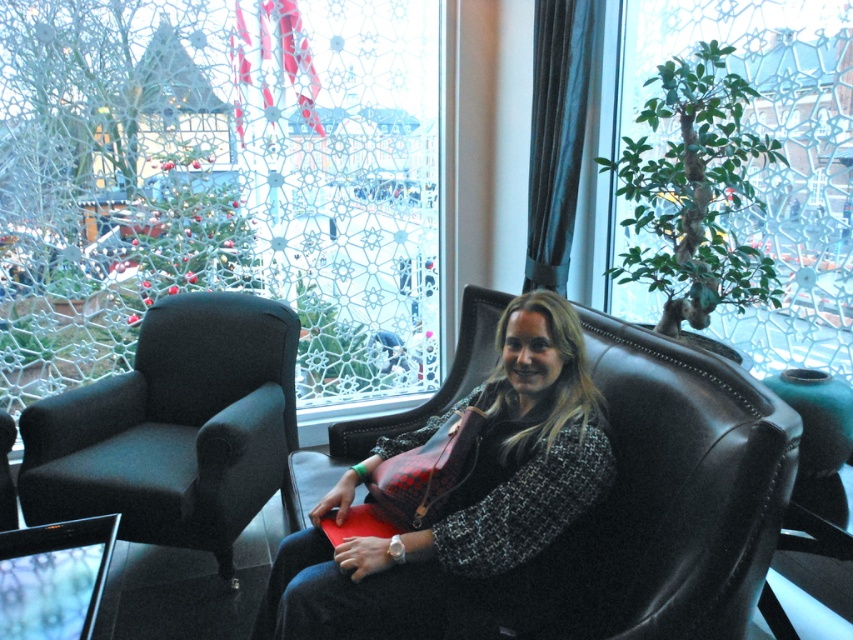
You are standing in the lounge and want to place a 1.5 meter long banner between yourself and the point at coordinates point [573,420]. Will the banner fit without overlapping anything?

The distance between you and the point [573,420] is 1.70 meters. Since the banner is 1.5 meters long, it will fit with a remaining space of 0.2 meters.